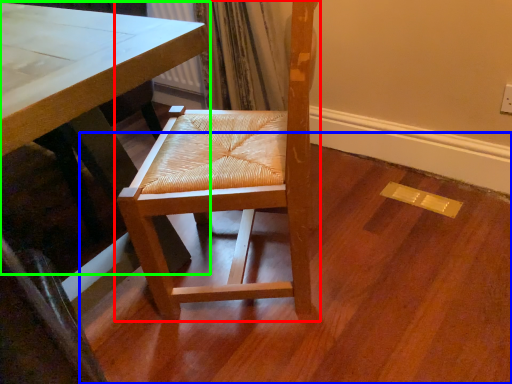
Question: Which is nearer to the chair (highlighted by a red box)? plywood (highlighted by a blue box) or table (highlighted by a green box).

Choices:
 (A) plywood
 (B) table

Answer: (B)